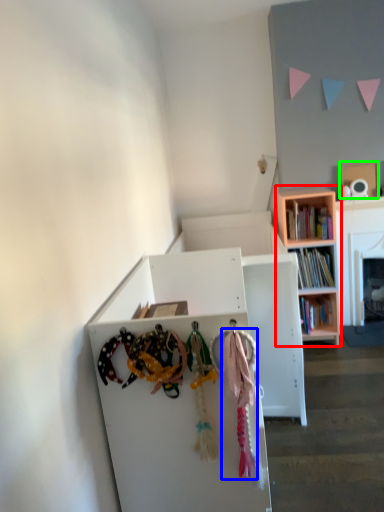
Question: Based on their relative distances, which object is farther from bookcase (highlighted by a red box)? Choose from clothesline (highlighted by a blue box) and cardboard box (highlighted by a green box).

Choices:
 (A) clothesline
 (B) cardboard box

Answer: (A)